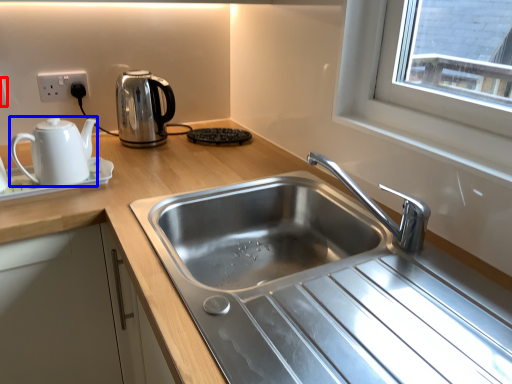
Question: Which object is closer to the camera taking this photo, electric outlet (highlighted by a red box) or kettle (highlighted by a blue box)?

Choices:
 (A) electric outlet
 (B) kettle

Answer: (B)